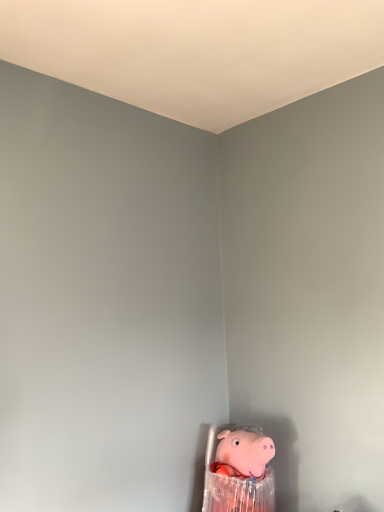
This screenshot has height=512, width=384. Describe the element at coordinates (239, 471) in the screenshot. I see `pink rubber pig at lower right` at that location.

Where is `pink rubber pig at lower right`? pink rubber pig at lower right is located at coordinates (239, 471).

This screenshot has height=512, width=384. Identify the location of pink rubber pig at lower right. pyautogui.click(x=239, y=471).